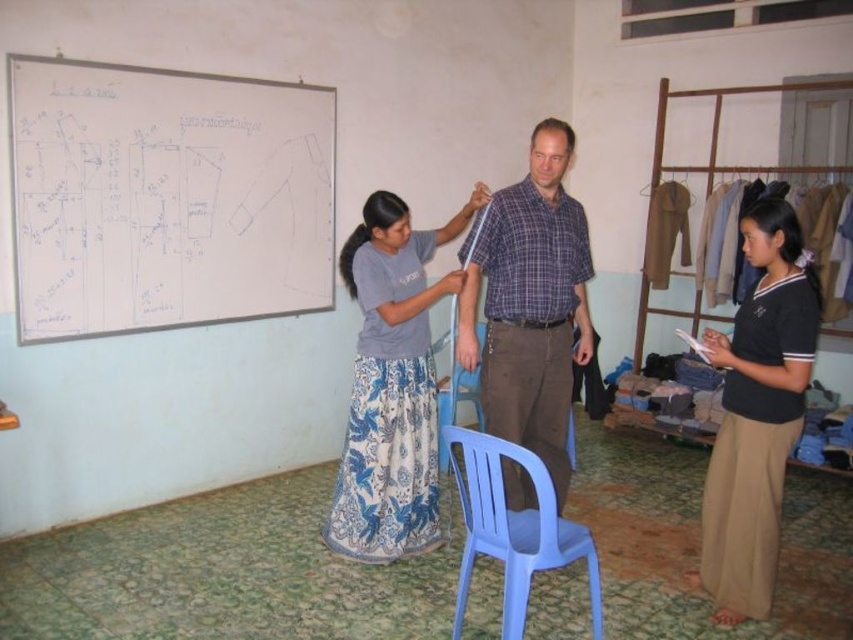
Who is lower down, white paperboard at upper left or blue floral skirt at center?

blue floral skirt at center is lower down.

Does white paperboard at upper left have a smaller size compared to blue floral skirt at center?

No, white paperboard at upper left is not smaller than blue floral skirt at center.

Is point (102, 164) farther from camera compared to point (380, 433)?

Yes, it is.

Locate an element on the screen. The image size is (853, 640). white paperboard at upper left is located at coordinates (165, 196).

Is black cotton skirt at lower right below blue plastic chair at lower center?

No, black cotton skirt at lower right is not below blue plastic chair at lower center.

Can you confirm if black cotton skirt at lower right is positioned to the right of blue plastic chair at lower center?

Correct, you'll find black cotton skirt at lower right to the right of blue plastic chair at lower center.

What do you see at coordinates (757, 413) in the screenshot? The image size is (853, 640). I see `black cotton skirt at lower right` at bounding box center [757, 413].

Identify the location of black cotton skirt at lower right. (757, 413).

Does blue floral skirt at center appear on the right side of plaid cotton shirt at center?

No, blue floral skirt at center is not to the right of plaid cotton shirt at center.

Is the position of blue floral skirt at center more distant than that of plaid cotton shirt at center?

Yes, it is behind plaid cotton shirt at center.

This screenshot has width=853, height=640. Describe the element at coordinates (392, 385) in the screenshot. I see `blue floral skirt at center` at that location.

Where is `blue floral skirt at center`? The height and width of the screenshot is (640, 853). blue floral skirt at center is located at coordinates 392,385.